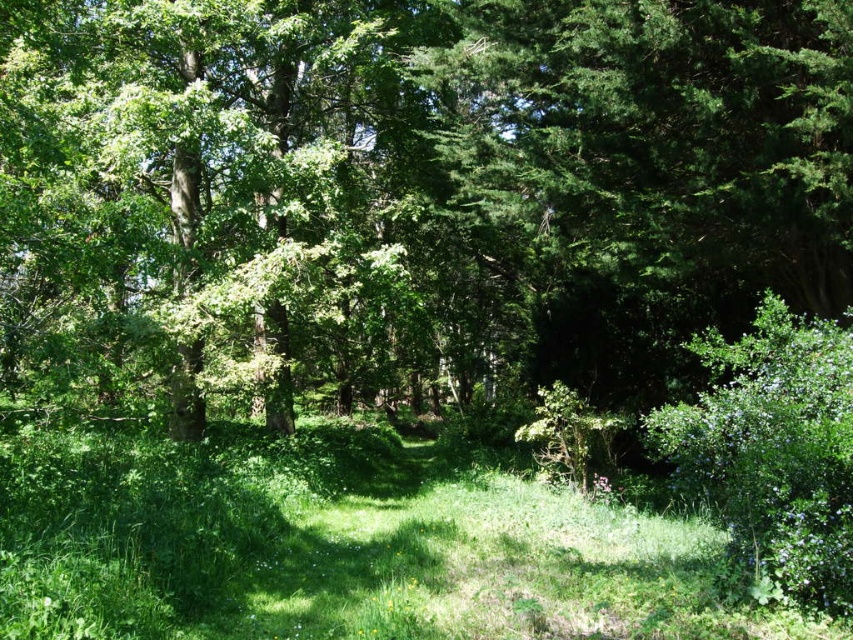
Does point (450, 216) come farther from viewer compared to point (492, 630)?

Yes, point (450, 216) is farther from viewer.

Who is positioned more to the right, green leafy tree at center or green grass at center?

From the viewer's perspective, green leafy tree at center appears more on the right side.

Which is behind, point (733, 273) or point (463, 589)?

Positioned behind is point (733, 273).

Where is `green leafy tree at center`? Image resolution: width=853 pixels, height=640 pixels. green leafy tree at center is located at coordinates (421, 179).